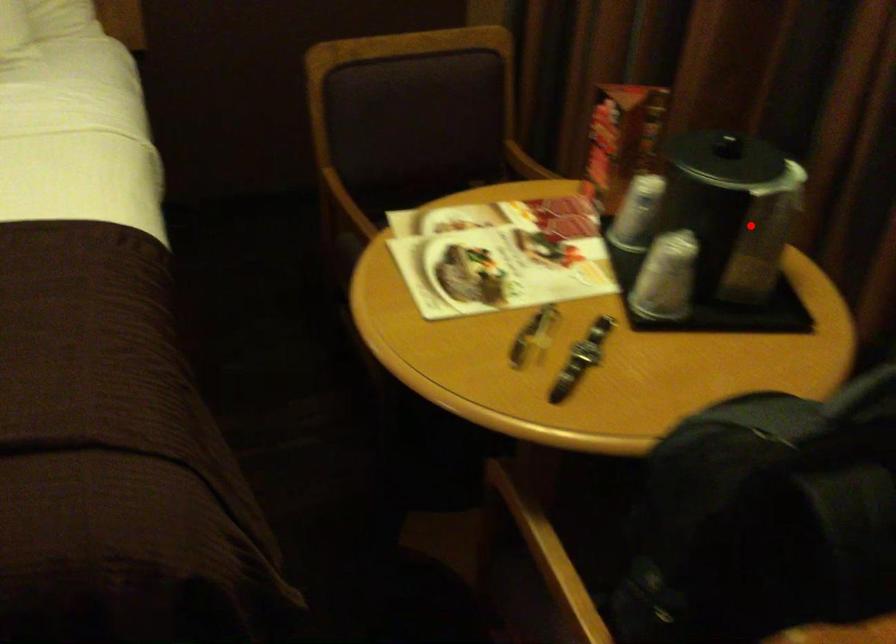
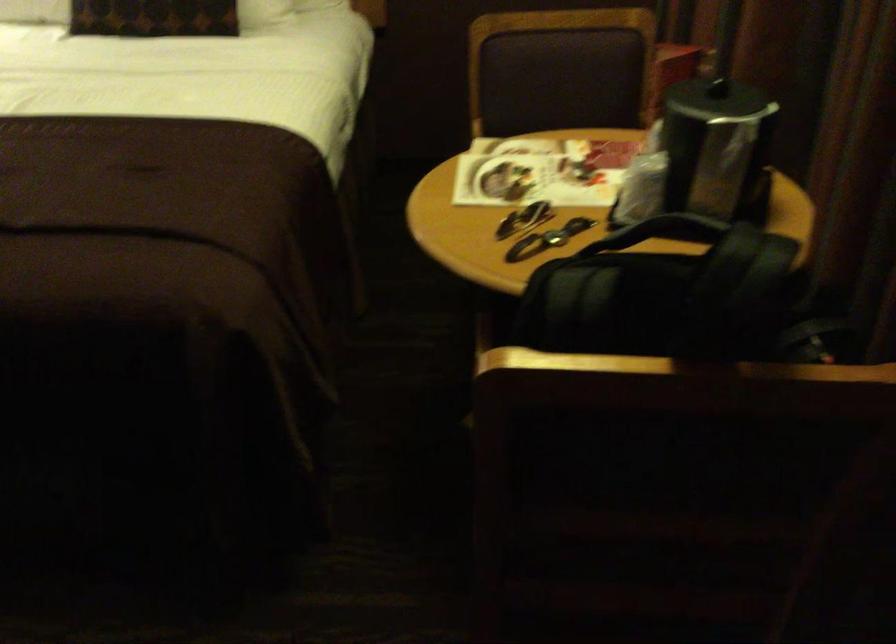
Question: I am providing you with two images of the same scene from different viewpoints. Given a red point in image1, look at the same physical point in image2. Is it:

Choices:
 (A) Closer to the viewpoint
 (B) Farther from the viewpoint

Answer: (B)